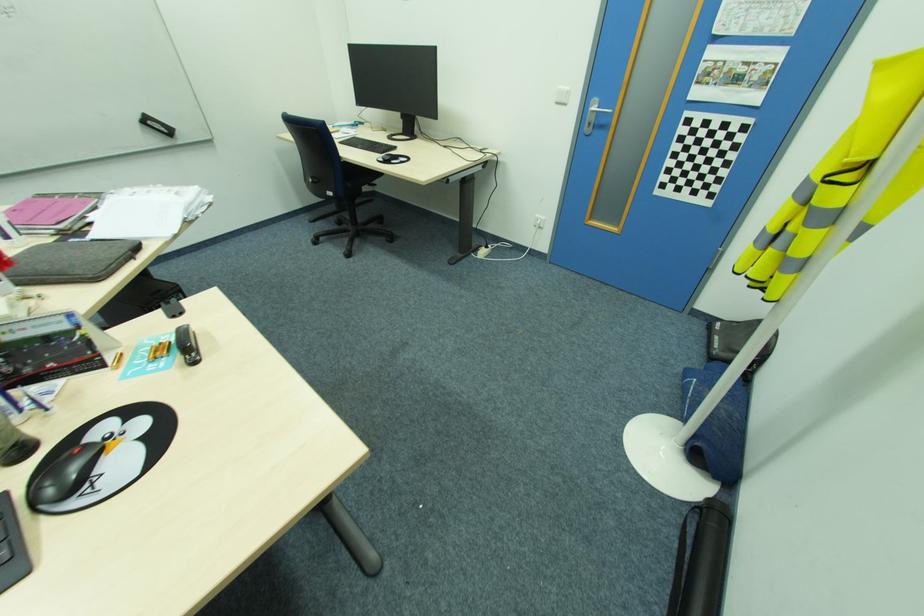
The image size is (924, 616). Identify the location of silver door handle. (599, 108).